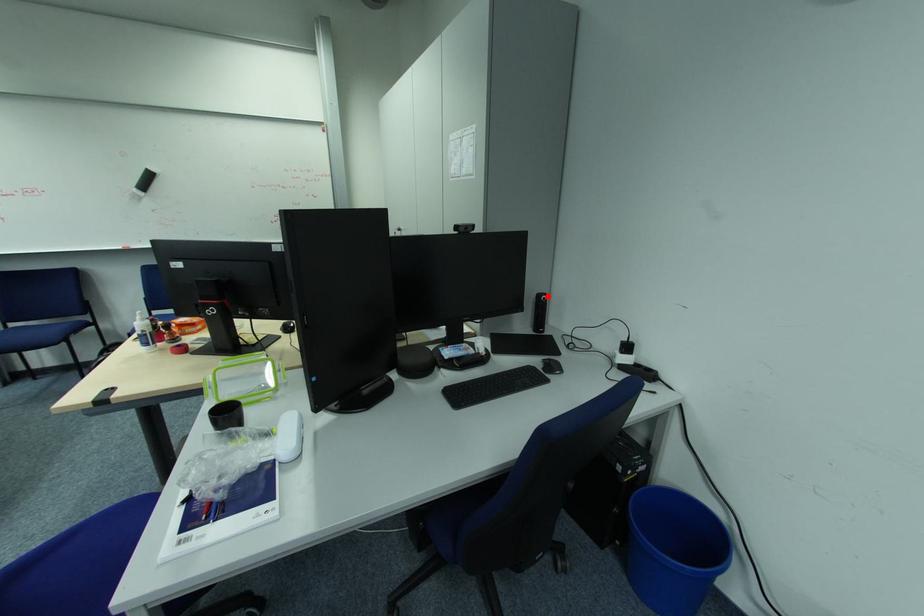
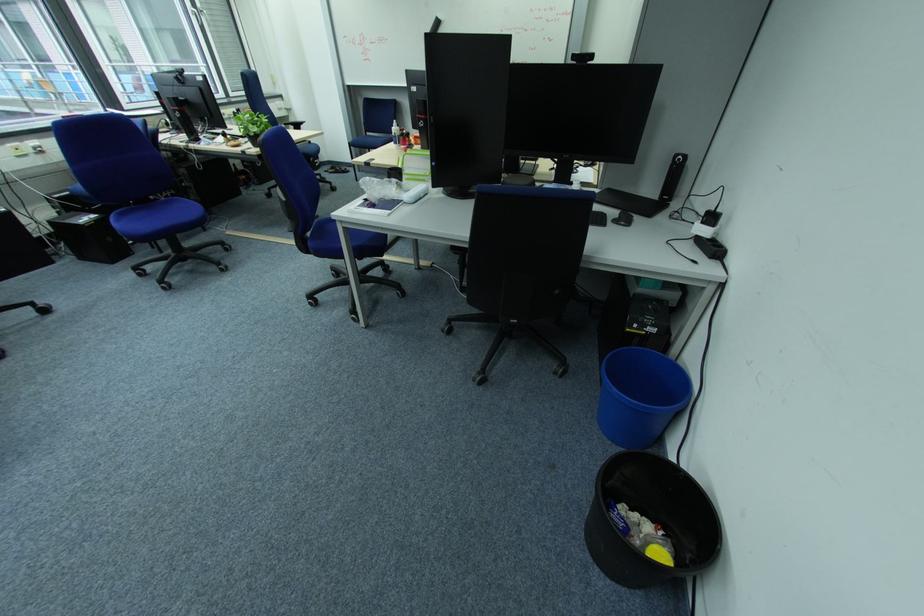
In the second image, find the point that corresponds to the highlighted location in the first image.

(686, 156)